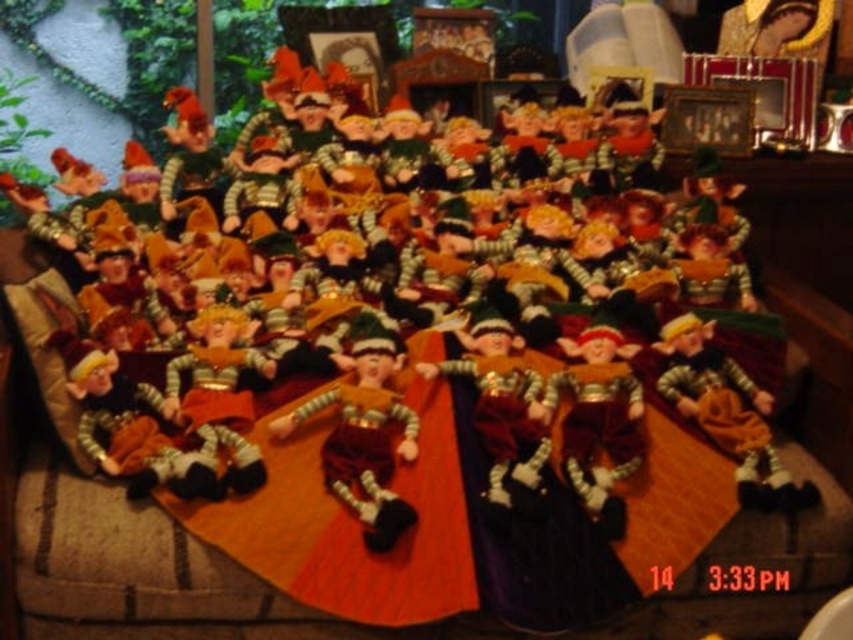
Who is more forward, (619, 422) or (514, 380)?

Point (619, 422)

Is velvet-like brown elf at center positioned in front of velvet-like red elf at center?

No, it is not.

Is point (631, 380) positioned in front of point (515, 467)?

No, (631, 380) is behind (515, 467).

The width and height of the screenshot is (853, 640). Find the location of `velvet-like brown elf at center`. velvet-like brown elf at center is located at coordinates (598, 422).

Does velvet maroon elf at center appear on the left side of velvet orange elf at center?

Correct, you'll find velvet maroon elf at center to the left of velvet orange elf at center.

Who is positioned more to the right, velvet maroon elf at center or velvet orange elf at center?

Positioned to the right is velvet orange elf at center.

Measure the distance between point (x=334, y=445) and camera.

A distance of 4.67 feet exists between point (x=334, y=445) and camera.

Locate an element on the screen. This screenshot has height=640, width=853. velvet maroon elf at center is located at coordinates (364, 436).

Can you confirm if velvet orange elf at center is shorter than velvet-like brown elf at center?

Indeed, velvet orange elf at center has a lesser height compared to velvet-like brown elf at center.

Is velvet orange elf at center above velvet-like brown elf at center?

Yes, velvet orange elf at center is above velvet-like brown elf at center.

Image resolution: width=853 pixels, height=640 pixels. What are the coordinates of `velvet orange elf at center` in the screenshot? It's located at (728, 413).